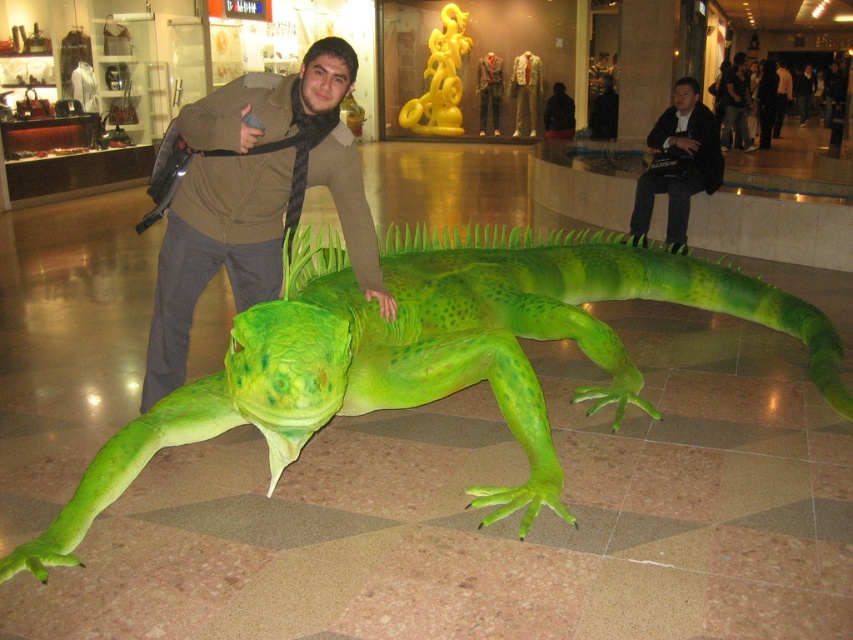
Is point (527, 68) positioned after point (570, 128)?

Yes, it is behind point (570, 128).

Does matte green suit at center have a smaller size compared to black matte jacket at center?

Indeed, matte green suit at center has a smaller size compared to black matte jacket at center.

Is point (515, 131) behind point (555, 128)?

Yes, it is behind point (555, 128).

Locate an element on the screen. This screenshot has height=640, width=853. matte green suit at center is located at coordinates (525, 88).

Image resolution: width=853 pixels, height=640 pixels. What do you see at coordinates (430, 355) in the screenshot?
I see `green matte/life-like lizard at center` at bounding box center [430, 355].

Locate an element on the screen. This screenshot has height=640, width=853. green matte/life-like lizard at center is located at coordinates (430, 355).

Looking at this image, does green matte/life-like lizard at center lie in front of matte gray jacket at center?

That is True.

Is green matte/life-like lizard at center above matte gray jacket at center?

Actually, green matte/life-like lizard at center is below matte gray jacket at center.

What do you see at coordinates (430, 355) in the screenshot? I see `green matte/life-like lizard at center` at bounding box center [430, 355].

Locate an element on the screen. Image resolution: width=853 pixels, height=640 pixels. green matte/life-like lizard at center is located at coordinates (430, 355).